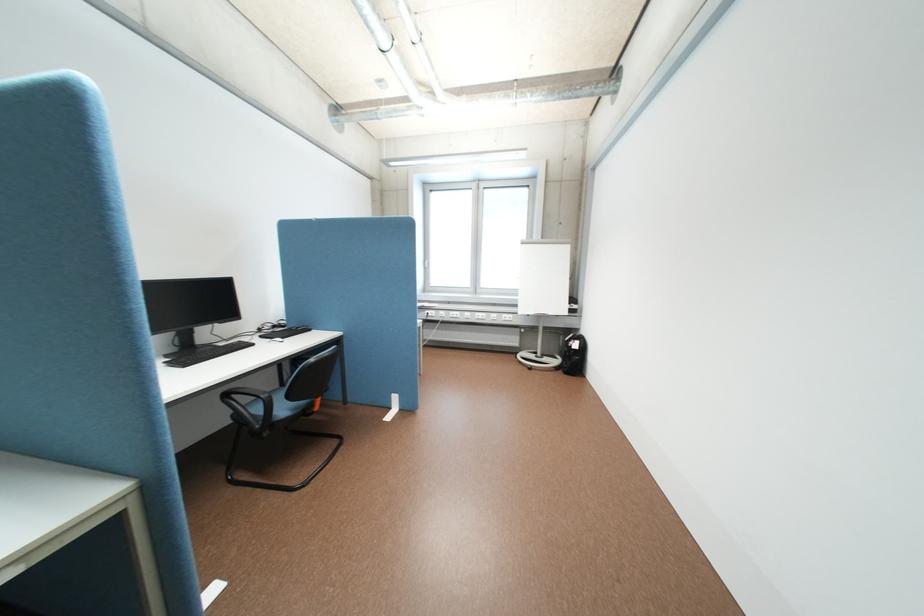
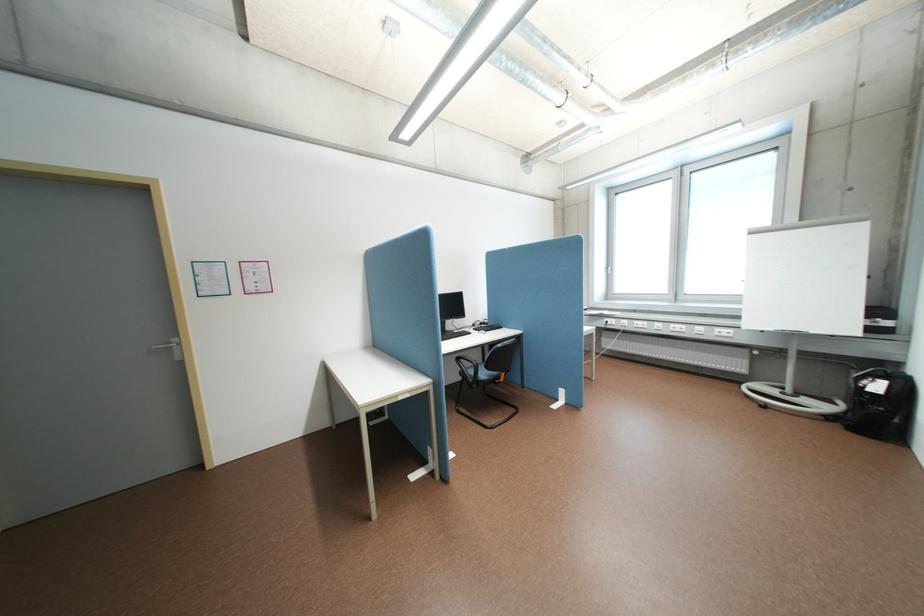
The point at [570,371] is marked in the first image. Where is the corresponding point in the second image?

(848, 424)